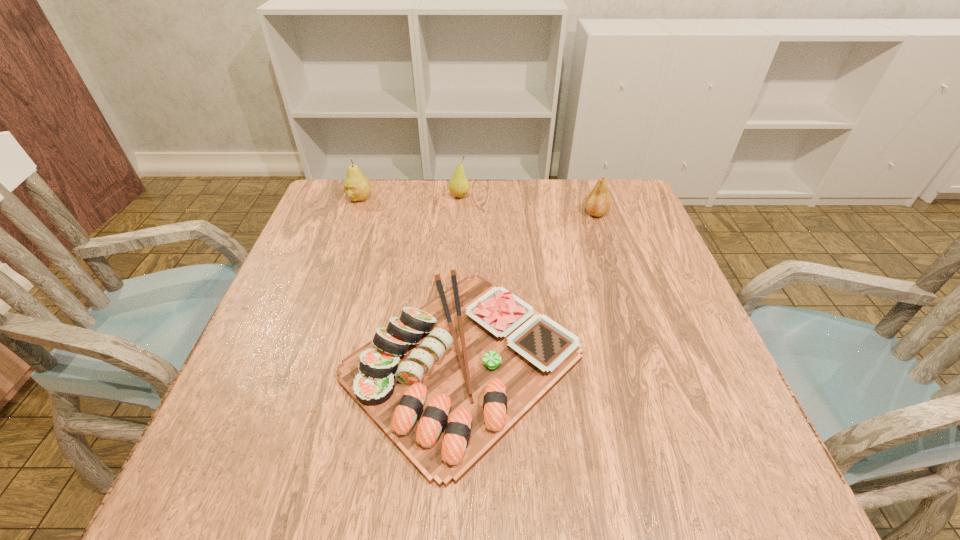
In the image, there is a desktop. At what (x,y) coordinates should I click in order to perform the action: click on vacant region at the near right corner. Please return your answer as a coordinate pair (x, y). The image size is (960, 540). Looking at the image, I should click on [x=733, y=494].

This screenshot has width=960, height=540. Identify the location of free spot between the leftmost pear and the rightmost pear. (477, 206).

I want to click on vacant space that is in between the nearest pear and the platter, so click(529, 287).

Locate an element on the screen. vacant space that's between the second pear from left to right and the nearest pear is located at coordinates (528, 205).

At what (x,y) coordinates should I click in order to perform the action: click on vacant area that lies between the leftmost object and the shortest object. Please return your answer as a coordinate pair (x, y). The width and height of the screenshot is (960, 540). Looking at the image, I should click on (411, 280).

The height and width of the screenshot is (540, 960). I want to click on unoccupied area between the leftmost object and the rightmost object, so 477,206.

Locate an element on the screen. The width and height of the screenshot is (960, 540). unoccupied position between the second pear from left to right and the shortest object is located at coordinates (461, 279).

Locate an element on the screen. blank region between the third farthest object and the second pear from left to right is located at coordinates (528, 205).

Identify the location of empty space between the second pear from right to left and the leftmost pear. Image resolution: width=960 pixels, height=540 pixels. (409, 197).

Find the location of a particular element. The height and width of the screenshot is (540, 960). free space between the third farthest object and the leftmost object is located at coordinates (477, 206).